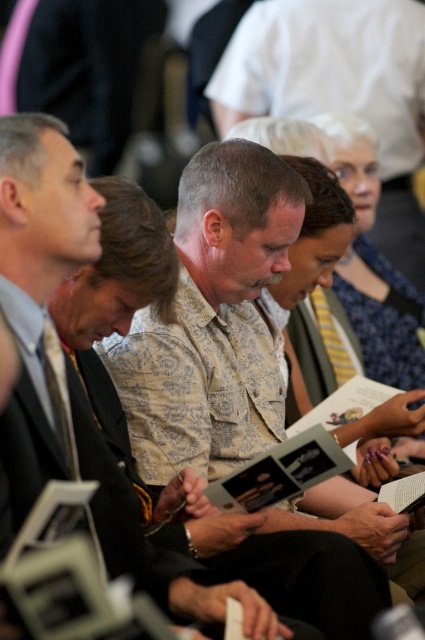
Who is lower down, patterned fabric shirt at center or floral-patterned shirt at center?

floral-patterned shirt at center

Can you confirm if patterned fabric shirt at center is bigger than floral-patterned shirt at center?

Yes.

At what (x,y) coordinates should I click in order to perform the action: click on patterned fabric shirt at center. Please return your answer as a coordinate pair (x, y). The image size is (425, 640). Looking at the image, I should click on (212, 321).